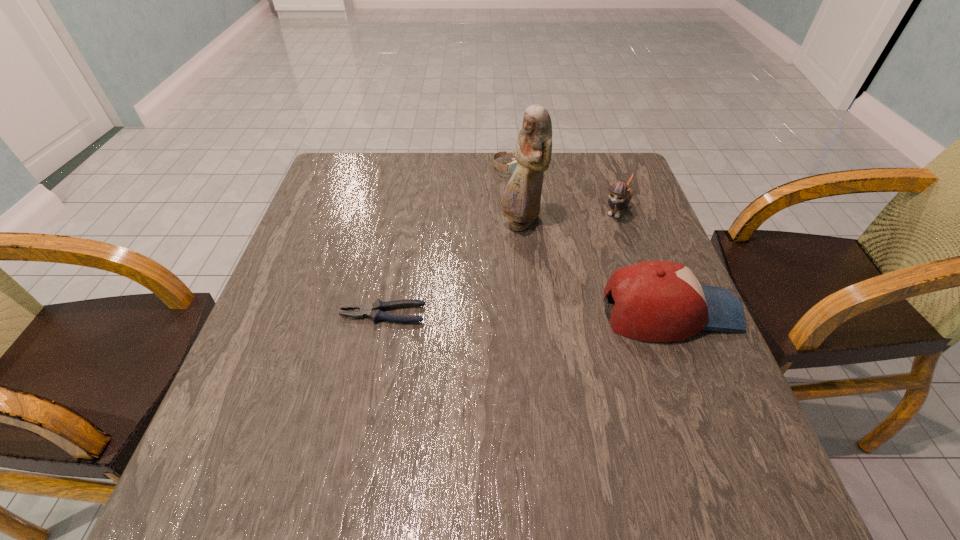
This screenshot has width=960, height=540. Find the location of `vacant space located on the front-facing side of the kitten`. vacant space located on the front-facing side of the kitten is located at coordinates (571, 287).

I want to click on vacant area situated on the front-facing side of the kitten, so click(557, 310).

I want to click on vacant space located 0.110m on the front-facing side of the kitten, so click(x=596, y=248).

This screenshot has width=960, height=540. Find the location of `vacant space located on the front-facing side of the tallest object`. vacant space located on the front-facing side of the tallest object is located at coordinates (493, 324).

Identify the location of vacant region located on the front-facing side of the tallest object. The height and width of the screenshot is (540, 960). (490, 340).

Image resolution: width=960 pixels, height=540 pixels. I want to click on free location located on the front-facing side of the tallest object, so click(x=503, y=289).

Identify the location of free space located 0.250m on the face of the farthest object. (509, 232).

At what (x,y) coordinates should I click in order to perform the action: click on vacant space located on the face of the farthest object. Please return your answer as a coordinate pair (x, y). The image size is (960, 540). Looking at the image, I should click on [x=507, y=251].

Find the location of a particular element. This screenshot has width=960, height=540. free space located 0.270m on the face of the farthest object is located at coordinates (508, 238).

Find the location of a particular element. This screenshot has width=960, height=540. kitten at the far edge is located at coordinates (620, 194).